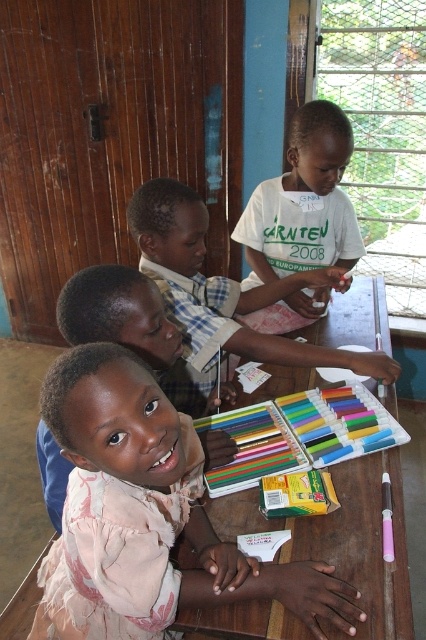
Can you confirm if white cotton shirt at center is positioned above matte pink dress at center?

Correct, white cotton shirt at center is located above matte pink dress at center.

Between white cotton shirt at center and matte pink dress at center, which one appears on the right side from the viewer's perspective?

white cotton shirt at center

Between point (331, 136) and point (167, 385), which one is positioned in front?

Point (167, 385) is more forward.

Find the location of a particular element. The image size is (426, 640). white cotton shirt at center is located at coordinates (304, 202).

Is matte white shirt at center to the right of white cotton shirt at center from the viewer's perspective?

No, matte white shirt at center is not to the right of white cotton shirt at center.

Is matte white shirt at center bigger than white cotton shirt at center?

Yes.

I want to click on matte white shirt at center, so click(x=224, y=291).

Between matte white shirt at center and matte pink dress at center, which one is positioned lower?

matte pink dress at center is below.

How distant is matte white shirt at center from matte pink dress at center?

matte white shirt at center is 11.81 inches away from matte pink dress at center.

What do you see at coordinates (224, 291) in the screenshot? I see `matte white shirt at center` at bounding box center [224, 291].

Where is `matte white shirt at center`? The height and width of the screenshot is (640, 426). matte white shirt at center is located at coordinates (224, 291).